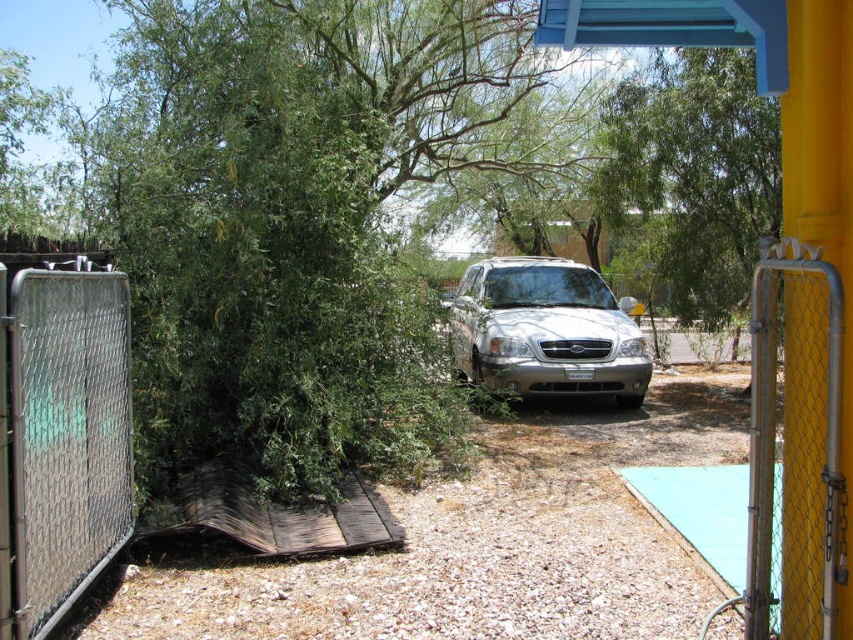
Question: Is green leafy tree at upper center above yellow chain-link gate at right?

Choices:
 (A) no
 (B) yes

Answer: (B)

Question: Does green leafy tree at upper center have a larger size compared to yellow chain-link gate at right?

Choices:
 (A) yes
 (B) no

Answer: (A)

Question: Which of the following is the farthest from the observer?

Choices:
 (A) (515, 260)
 (B) (25, 509)

Answer: (A)

Question: Which point is closer to the camera taking this photo?

Choices:
 (A) (740, 276)
 (B) (793, 433)
 (C) (749, 26)

Answer: (B)

Question: Among these points, which one is farthest from the camera?

Choices:
 (A) coord(625,134)
 (B) coord(62,520)
 (C) coord(785,74)

Answer: (A)

Question: Can you confirm if silver chain-link fence at left is wider than yellow chain-link gate at right?

Choices:
 (A) no
 (B) yes

Answer: (A)